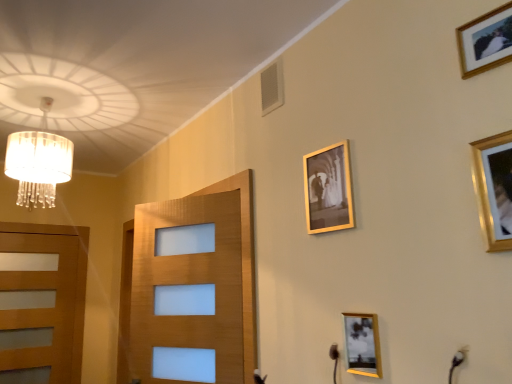
Question: In terms of size, does translucent glass chandelier at upper left appear bigger or smaller than gold-framed photo at lower right, the second picture frame viewed from the back?

Choices:
 (A) big
 (B) small

Answer: (A)

Question: Considering the positions of translucent glass chandelier at upper left and gold-framed photo at lower right, the fourth picture frame in the top-to-bottom sequence, in the image, is translucent glass chandelier at upper left taller or shorter than gold-framed photo at lower right, the fourth picture frame in the top-to-bottom sequence,?

Choices:
 (A) tall
 (B) short

Answer: (A)

Question: Estimate the real-world distances between objects in this image. Which object is farther from the gold metallic picture frame at upper center, which is counted as the 4th picture frame, starting from the right?

Choices:
 (A) gold-framed photo at upper right, arranged as the third picture frame when viewed from the left
 (B) gold-framed photo at lower right, which is counted as the 3th picture frame, starting from the front
 (C) wooden door at left
 (D) translucent glass chandelier at upper left
 (E) gold metallic picture frame at upper right, acting as the 3th picture frame starting from the bottom

Answer: (C)

Question: Based on their relative distances, which object is nearer to the gold metallic picture frame at upper center, which ranks as the 1th picture frame in back-to-front order?

Choices:
 (A) gold-framed photo at upper right, which is counted as the second picture frame, starting from the right
 (B) translucent glass chandelier at upper left
 (C) wooden door at left
 (D) gold-framed photo at lower right, the first picture frame from the bottom
 (E) gold metallic picture frame at upper right, the 4th picture frame positioned from the back

Answer: (D)